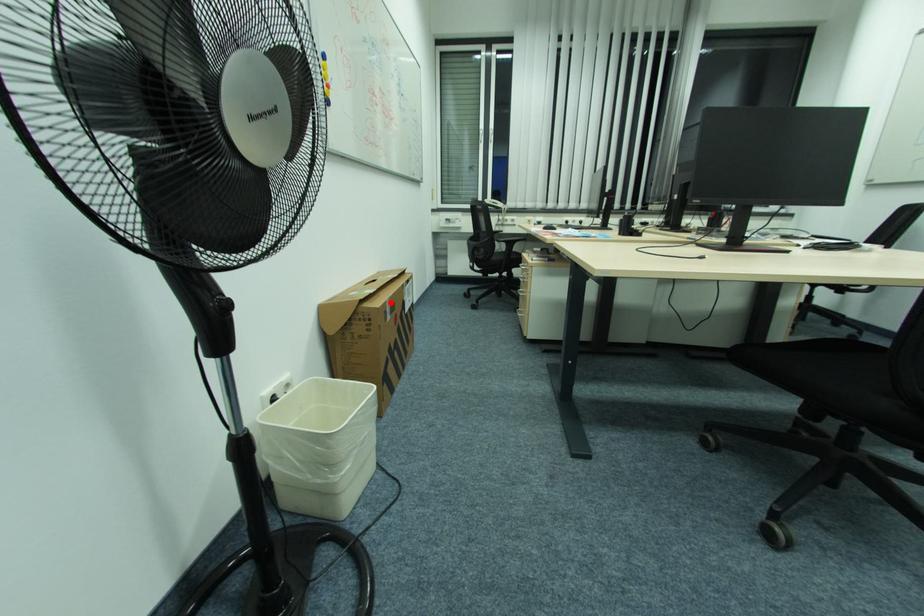
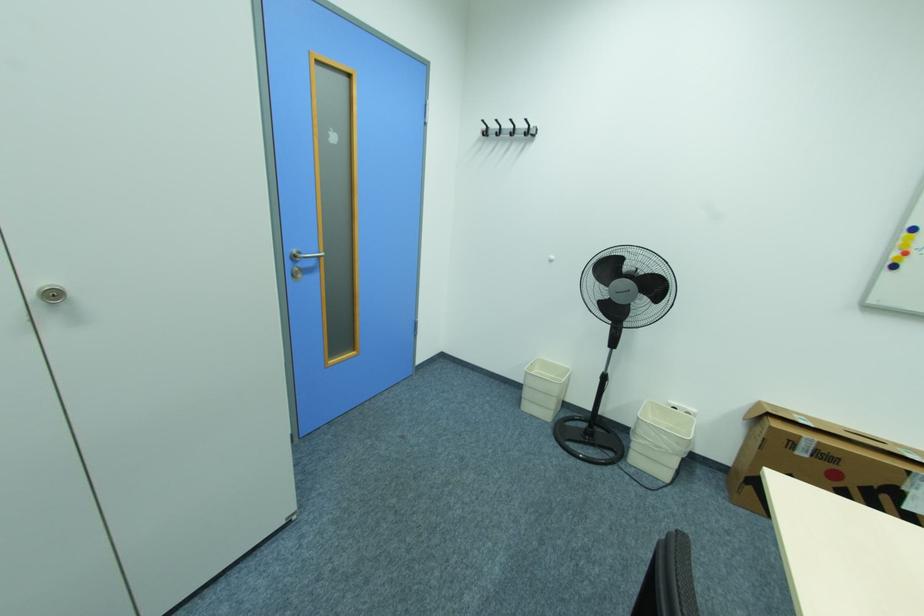
Where in the second image is the point corresponding to the highlighted location from the first image?

(805, 437)